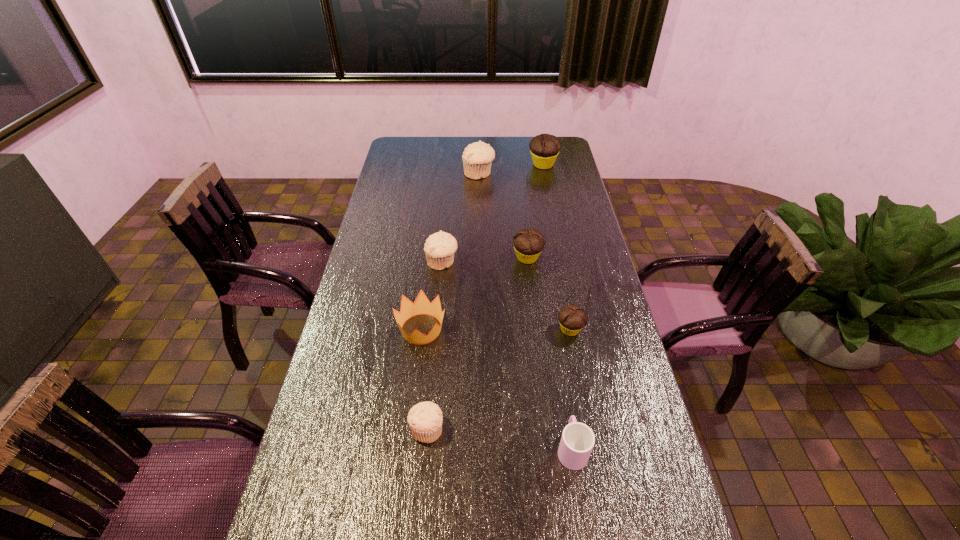
The height and width of the screenshot is (540, 960). Find the location of `vacant area in the image that satisfies the following two spatial constraints: 1. on the back side of the second farthest chocolate muffin; 2. on the right side of the second biggest beige muffin`. vacant area in the image that satisfies the following two spatial constraints: 1. on the back side of the second farthest chocolate muffin; 2. on the right side of the second biggest beige muffin is located at coordinates (443, 258).